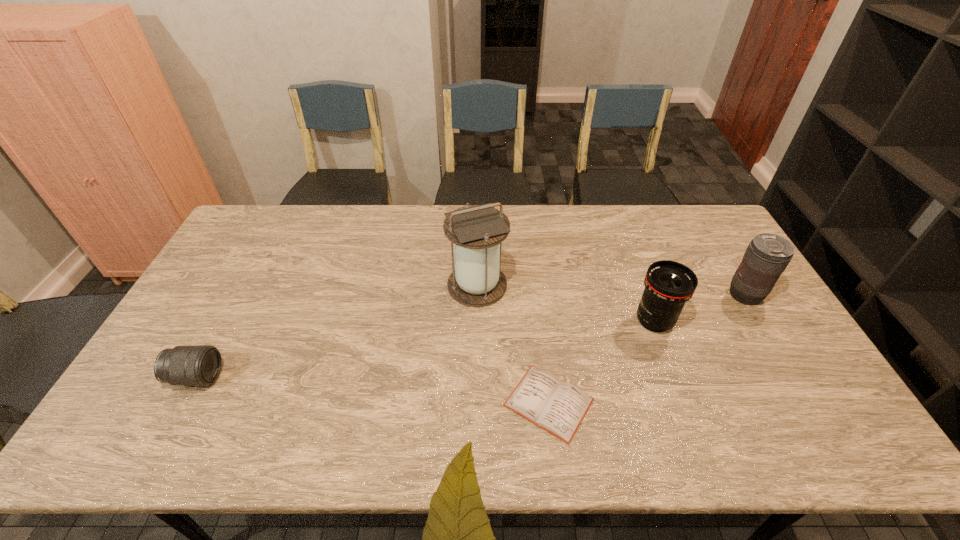
Locate an element on the screen. free space that is in between the lantern and the rightmost telephoto lens is located at coordinates (611, 291).

Image resolution: width=960 pixels, height=540 pixels. What are the coordinates of `free space between the shortest object and the second shortest object` in the screenshot? It's located at (372, 390).

Identify the location of empty space that is in between the fourth object from left to right and the rightmost telephoto lens. The image size is (960, 540). (700, 308).

Find the location of a particular element. The height and width of the screenshot is (540, 960). vacant region between the lantern and the leftmost telephoto lens is located at coordinates (337, 331).

At what (x,y) coordinates should I click in order to perform the action: click on vacant area that lies between the tallest object and the rightmost telephoto lens. Please return your answer as a coordinate pair (x, y). Image resolution: width=960 pixels, height=540 pixels. Looking at the image, I should click on (611, 291).

In order to click on vacant space that's between the diary and the rightmost telephoto lens in this screenshot , I will do `click(647, 349)`.

The width and height of the screenshot is (960, 540). Find the location of `free space between the leftmost telephoto lens and the rightmost telephoto lens`. free space between the leftmost telephoto lens and the rightmost telephoto lens is located at coordinates (470, 336).

Locate an element on the screen. The height and width of the screenshot is (540, 960). free space between the lantern and the second telephoto lens from right to left is located at coordinates (565, 303).

Find the location of a particular element. The height and width of the screenshot is (540, 960). free point between the tallest object and the fourth object from left to right is located at coordinates (565, 303).

The image size is (960, 540). Find the location of `free space between the nearest telephoto lens and the tallest object`. free space between the nearest telephoto lens and the tallest object is located at coordinates tap(337, 331).